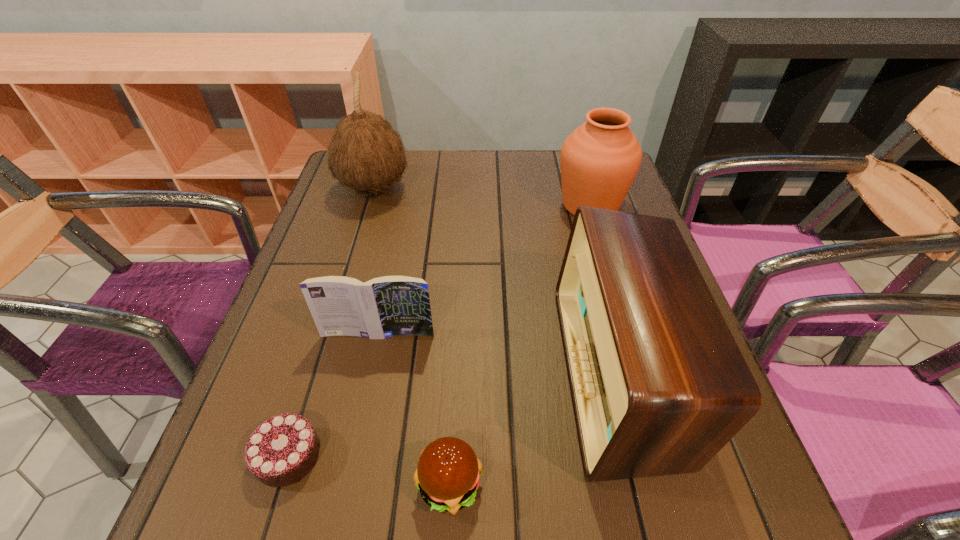
I want to click on empty location between the shortest object and the hamburger, so click(369, 470).

The height and width of the screenshot is (540, 960). Find the location of `object that is the fourth closest to the tallest object`. object that is the fourth closest to the tallest object is located at coordinates (281, 451).

Identify which object is located as the fourth nearest to the urn. Please provide its 2D coordinates. Your answer should be formatted as a tuple, i.e. [(x, y)], where the tuple contains the x and y coordinates of a point satisfying the conditions above.

[(448, 474)]

Where is `vacant area that satisfies the following two spatial constraints: 1. on the surface of the tallest object; 2. on the right side of the urn`? The width and height of the screenshot is (960, 540). vacant area that satisfies the following two spatial constraints: 1. on the surface of the tallest object; 2. on the right side of the urn is located at coordinates (370, 205).

Identify the location of free location that satisfies the following two spatial constraints: 1. on the surface of the urn; 2. on the left side of the tallest object. This screenshot has width=960, height=540. (370, 205).